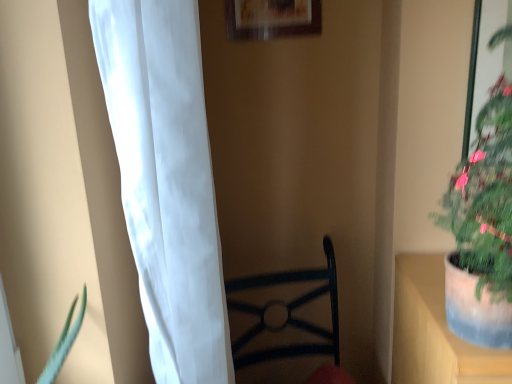
Question: Can you confirm if wooden picture frame at upper center is bigger than green matte plant at right?

Choices:
 (A) no
 (B) yes

Answer: (A)

Question: Does wooden picture frame at upper center turn towards green matte plant at right?

Choices:
 (A) yes
 (B) no

Answer: (B)

Question: From the image's perspective, is wooden picture frame at upper center above green matte plant at right?

Choices:
 (A) no
 (B) yes

Answer: (B)

Question: Would you say wooden picture frame at upper center is a long distance from green matte plant at right?

Choices:
 (A) no
 (B) yes

Answer: (A)

Question: Is wooden picture frame at upper center facing away from green matte plant at right?

Choices:
 (A) yes
 (B) no

Answer: (B)

Question: Is green matte plant at right located within wooden picture frame at upper center?

Choices:
 (A) no
 (B) yes

Answer: (A)

Question: Is white sheer curtain at left inside green matte plant at right?

Choices:
 (A) no
 (B) yes

Answer: (A)

Question: Does green matte plant at right have a larger size compared to white sheer curtain at left?

Choices:
 (A) yes
 (B) no

Answer: (B)

Question: Does green matte plant at right have a greater width compared to white sheer curtain at left?

Choices:
 (A) yes
 (B) no

Answer: (A)

Question: From the image's perspective, is green matte plant at right located beneath white sheer curtain at left?

Choices:
 (A) yes
 (B) no

Answer: (B)

Question: Is green matte plant at right oriented towards white sheer curtain at left?

Choices:
 (A) yes
 (B) no

Answer: (B)

Question: Is green matte plant at right completely or partially outside of white sheer curtain at left?

Choices:
 (A) no
 (B) yes

Answer: (B)

Question: Is wooden picture frame at upper center turned away from white sheer curtain at left?

Choices:
 (A) yes
 (B) no

Answer: (B)